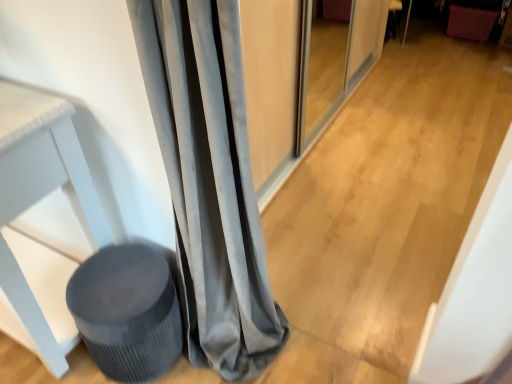
The width and height of the screenshot is (512, 384). In order to click on free point below velvet gray curtain at left (from a real-world perspective) in this screenshot , I will do `click(256, 362)`.